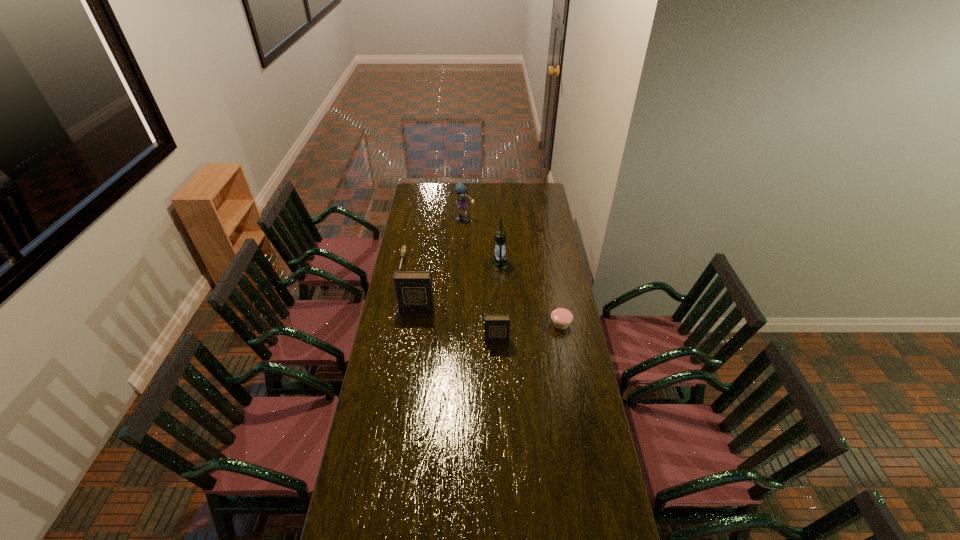
Where is `the farther diary`? the farther diary is located at coordinates (414, 290).

Find the location of a particular element. This screenshot has height=540, width=960. the second object from left to right is located at coordinates (414, 290).

In order to click on the shorter diary in this screenshot , I will do [496, 327].

In order to click on the nearest object in this screenshot , I will do tap(496, 327).

The height and width of the screenshot is (540, 960). What are the coordinates of `rag doll` in the screenshot? It's located at (460, 189).

This screenshot has height=540, width=960. In order to click on the third object from left to right in this screenshot , I will do `click(460, 189)`.

Where is `the second nearest object`? The width and height of the screenshot is (960, 540). the second nearest object is located at coordinates (561, 318).

This screenshot has height=540, width=960. I want to click on the rightmost object, so click(x=561, y=318).

Locate an element on the screen. lantern is located at coordinates (499, 261).

Image resolution: width=960 pixels, height=540 pixels. What are the coordinates of `screwdriver` in the screenshot? It's located at (403, 250).